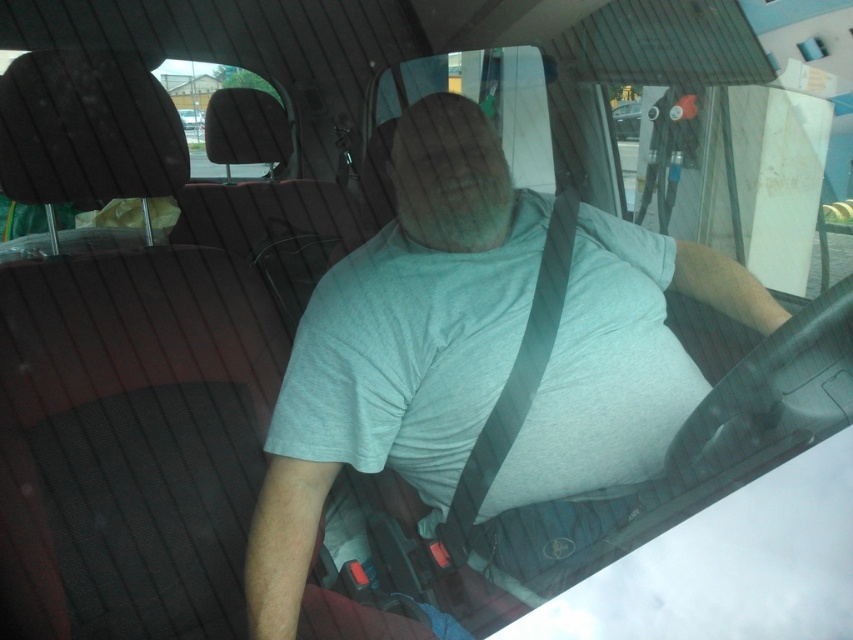
Is gray matte t-shirt at center bigger than transparent glass windshield at upper center?

Incorrect, gray matte t-shirt at center is not larger than transparent glass windshield at upper center.

Does gray matte t-shirt at center appear over transparent glass windshield at upper center?

Incorrect, gray matte t-shirt at center is not positioned above transparent glass windshield at upper center.

Is point (608, 433) more distant than point (611, 193)?

No.

This screenshot has width=853, height=640. In order to click on gray matte t-shirt at center in this screenshot , I will do `click(398, 344)`.

Is transparent glass windshield at upper center taller than metallic silver car at center?

Indeed, transparent glass windshield at upper center has a greater height compared to metallic silver car at center.

Does transparent glass windshield at upper center have a smaller size compared to metallic silver car at center?

No, transparent glass windshield at upper center is not smaller than metallic silver car at center.

Between point (851, 227) and point (624, 124), which one is positioned behind?

The point (624, 124) is behind.

At what (x,y) coordinates should I click in order to perform the action: click on transparent glass windshield at upper center. Please return your answer as a coordinate pair (x, y). This screenshot has width=853, height=640. Looking at the image, I should click on (645, 118).

How much distance is there between transparent glass windshield at upper center and gray fabric seatbelt at center?

4.17 feet

Which of these two, transparent glass windshield at upper center or gray fabric seatbelt at center, stands taller?

transparent glass windshield at upper center is taller.

The image size is (853, 640). What do you see at coordinates (645, 118) in the screenshot?
I see `transparent glass windshield at upper center` at bounding box center [645, 118].

Image resolution: width=853 pixels, height=640 pixels. In order to click on transparent glass windshield at upper center in this screenshot , I will do `click(645, 118)`.